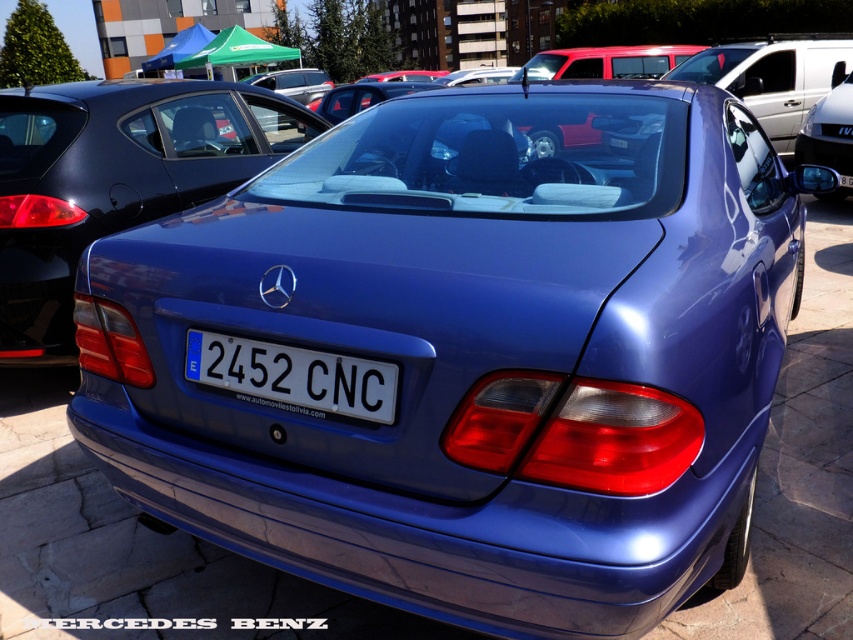
Question: From the image, what is the correct spatial relationship of metallic blue sedan at center in relation to black plastic license plate at center?

Choices:
 (A) left
 (B) right

Answer: (A)

Question: Which point is closer to the camera?

Choices:
 (A) black plastic license plate at center
 (B) metallic blue sedan at right

Answer: (A)

Question: Is black plastic license plate at center positioned before metallic blue sedan at right?

Choices:
 (A) no
 (B) yes

Answer: (B)

Question: Which object is positioned farthest from the black plastic license plate at center?

Choices:
 (A) metallic blue sedan at right
 (B) metallic blue sedan at center

Answer: (A)

Question: Is metallic blue sedan at center bigger than metallic blue sedan at right?

Choices:
 (A) yes
 (B) no

Answer: (A)

Question: Which of these objects is positioned closest to the black plastic license plate at center?

Choices:
 (A) metallic blue sedan at right
 (B) metallic blue sedan at center

Answer: (B)